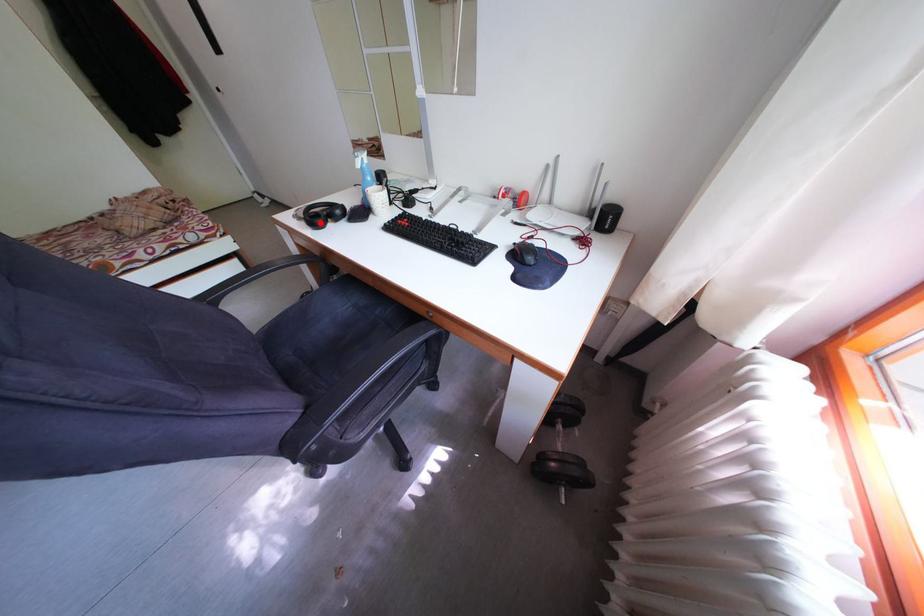
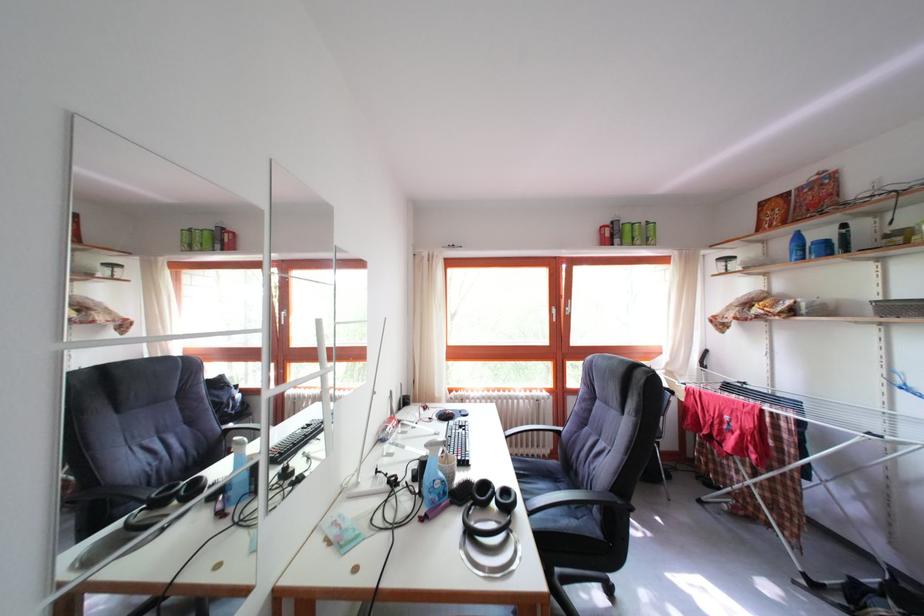
Question: I am providing you with two images of the same scene from different viewpoints. A red point is marked on the first image. At the location where the point appears in image 1, is it still visible in image 2?

Choices:
 (A) Yes
 (B) No

Answer: (B)